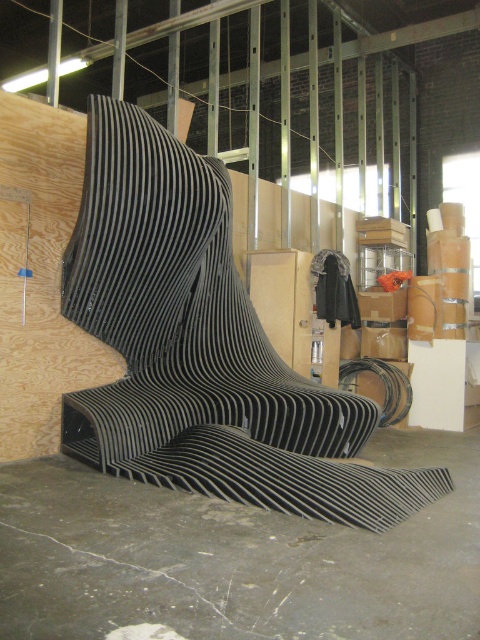
Question: Is black striped bench at center smaller than matte cardboard box at center-right?

Choices:
 (A) no
 (B) yes

Answer: (A)

Question: Does black striped bench at center appear under matte cardboard box at center-right?

Choices:
 (A) no
 (B) yes

Answer: (B)

Question: Is black striped bench at center wider than matte cardboard box at center-right?

Choices:
 (A) yes
 (B) no

Answer: (A)

Question: Which of the following is the farthest from the observer?

Choices:
 (A) (277, 483)
 (B) (404, 289)

Answer: (B)

Question: Among these points, which one is farthest from the camera?

Choices:
 (A) (120, 144)
 (B) (360, 312)

Answer: (B)